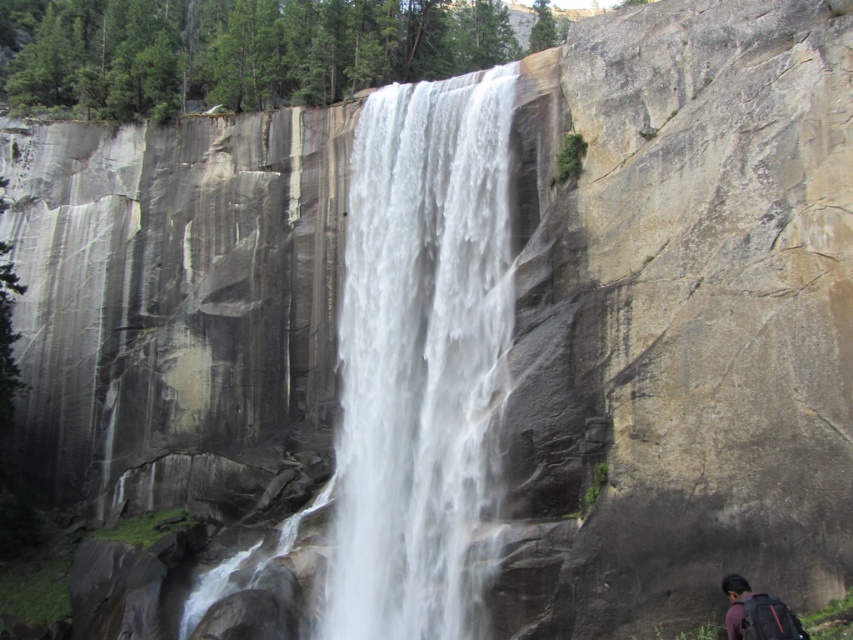
Is point (432, 392) closer to viewer compared to point (753, 612)?

No, (432, 392) is behind (753, 612).

Does white smooth waterfall at center have a larger size compared to dark gray backpack at lower right?

Indeed, white smooth waterfall at center has a larger size compared to dark gray backpack at lower right.

Between point (355, 138) and point (749, 637), which one is positioned in front?

Point (749, 637) is more forward.

Locate an element on the screen. The image size is (853, 640). white smooth waterfall at center is located at coordinates (419, 353).